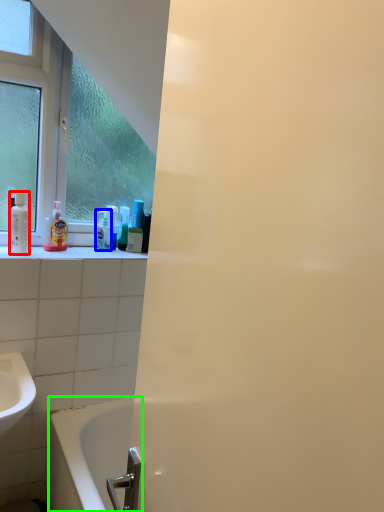
Question: Based on their relative distances, which object is nearer to mouthwash (highlighted by a red box)? Choose from cleaning product (highlighted by a blue box) and bathtub (highlighted by a green box).

Choices:
 (A) cleaning product
 (B) bathtub

Answer: (A)